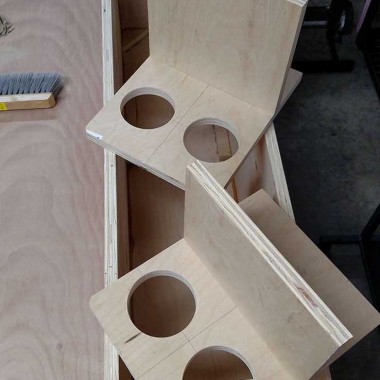
I want to click on top cup holder, so click(221, 82).